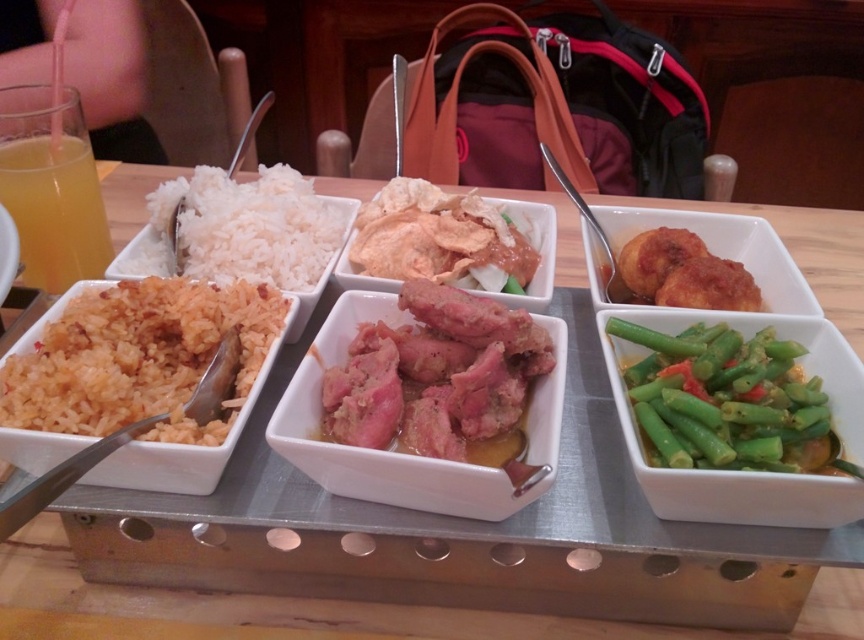
Does white ceramic tray at center have a smaller size compared to pinkish-brown meat at center?

No.

Is point (213, 513) farther from viewer compared to point (440, 394)?

No, (213, 513) is in front of (440, 394).

Find the location of a particular element. This screenshot has width=864, height=640. white ceramic tray at center is located at coordinates (432, 541).

Is point (94, 378) in front of point (551, 356)?

Yes.

Is orange rice at left to the left of pinkish-brown meat at center from the viewer's perspective?

Indeed, orange rice at left is positioned on the left side of pinkish-brown meat at center.

I want to click on orange rice at left, so click(138, 356).

I want to click on orange rice at left, so click(138, 356).

This screenshot has height=640, width=864. What do you see at coordinates (138, 356) in the screenshot? I see `orange rice at left` at bounding box center [138, 356].

Is orange rice at left closer to the viewer compared to shiny brown meat at center?

Yes, orange rice at left is in front of shiny brown meat at center.

What do you see at coordinates (138, 356) in the screenshot? I see `orange rice at left` at bounding box center [138, 356].

Where is `orange rice at left`? This screenshot has height=640, width=864. orange rice at left is located at coordinates (138, 356).